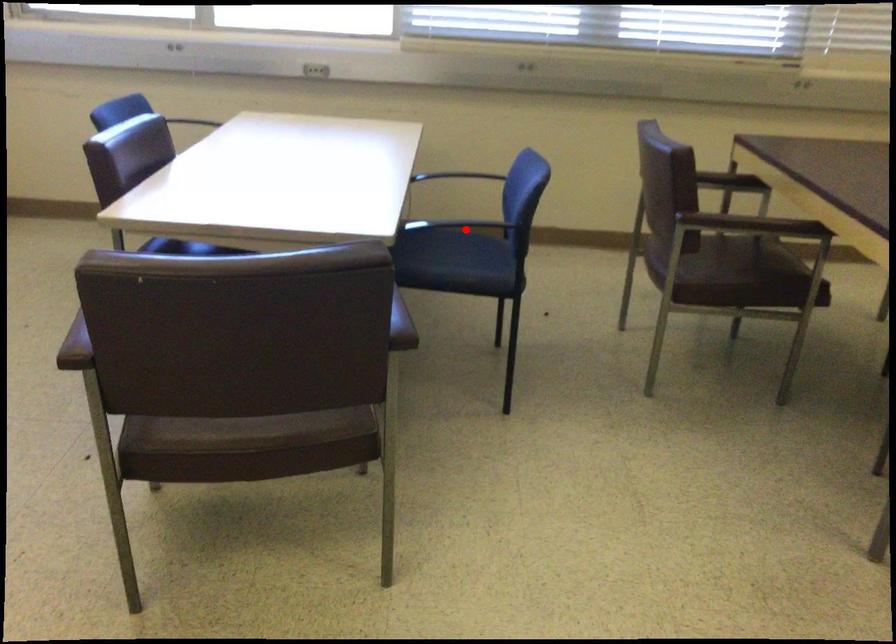
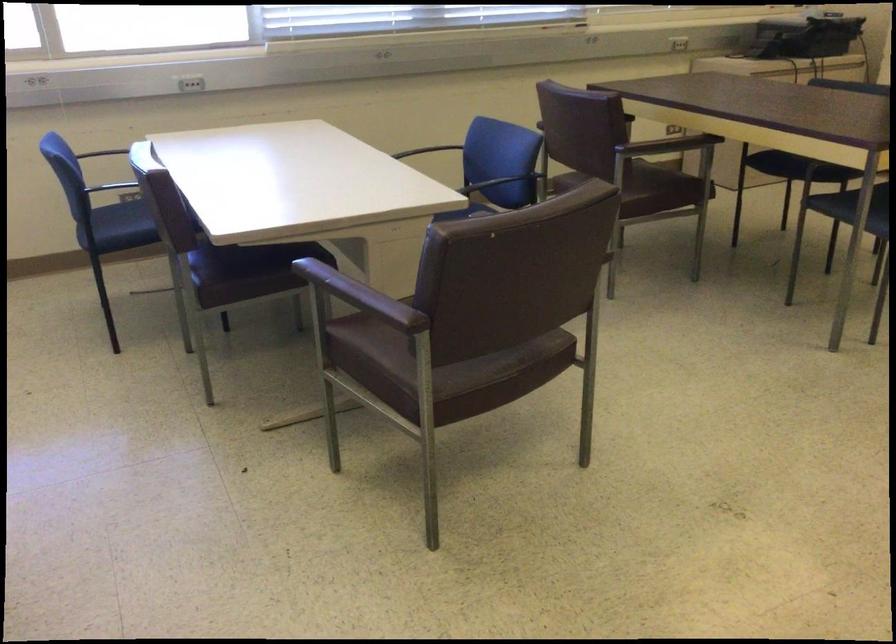
Question: I am providing you with two images of the same scene from different viewpoints. A red point is marked on the first image. Can you still see the location of the red point in image 2?

Choices:
 (A) Yes
 (B) No

Answer: (B)